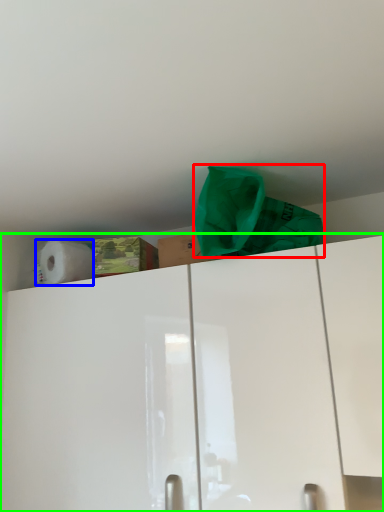
Question: Which is farther away from material (highlighted by a red box)? paper towel (highlighted by a blue box) or cabinetry (highlighted by a green box)?

Choices:
 (A) paper towel
 (B) cabinetry

Answer: (A)